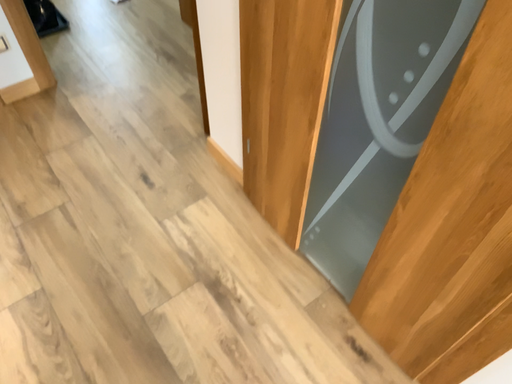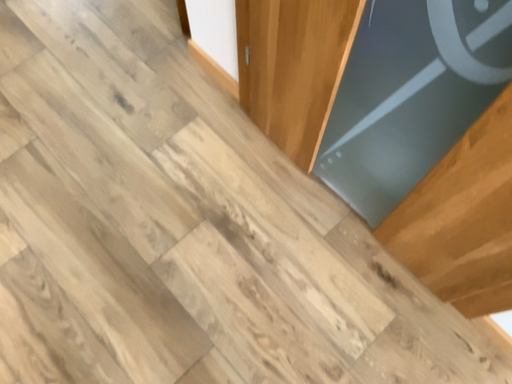
Question: How did the camera likely rotate when shooting the video?

Choices:
 (A) rotated downward
 (B) rotated upward

Answer: (A)